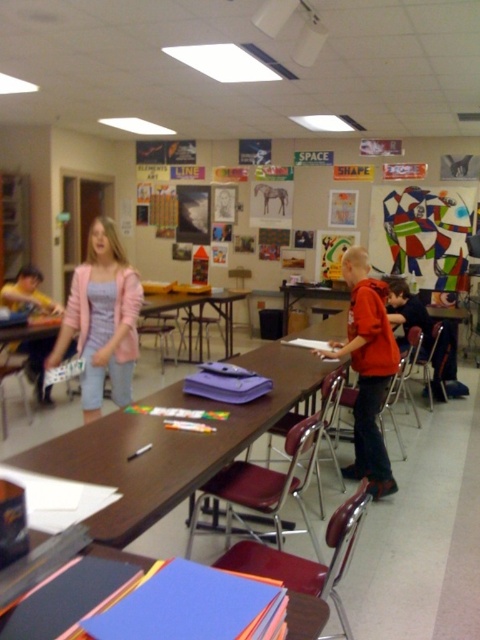
You are a student in the classroom and you want to know which clothing item takes up more horizontal space between the pink fabric jacket at center and the orange matte shirt at center. Which one is wider?

The orange matte shirt at center is wider than the pink fabric jacket at center.

You are a student in the classroom and need to place both the orange matte shirt at center and the smooth blue paper at center on your desk. Which object should you place first to ensure both fit on the desk?

The orange matte shirt at center has a larger width than the smooth blue paper at center, so you should place the orange matte shirt at center first to ensure both fit on the desk.